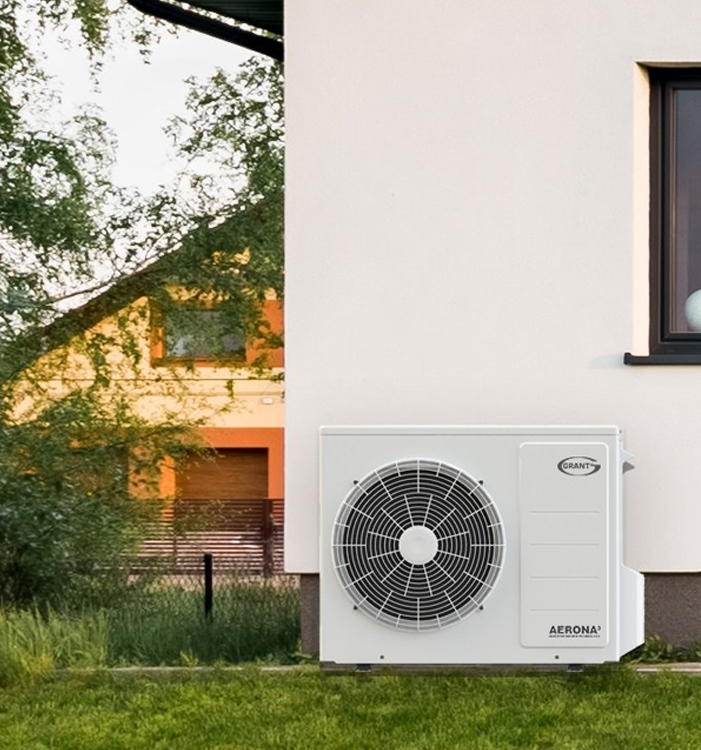
This screenshot has width=701, height=750. Identify the location of window. (667, 246), (214, 348).